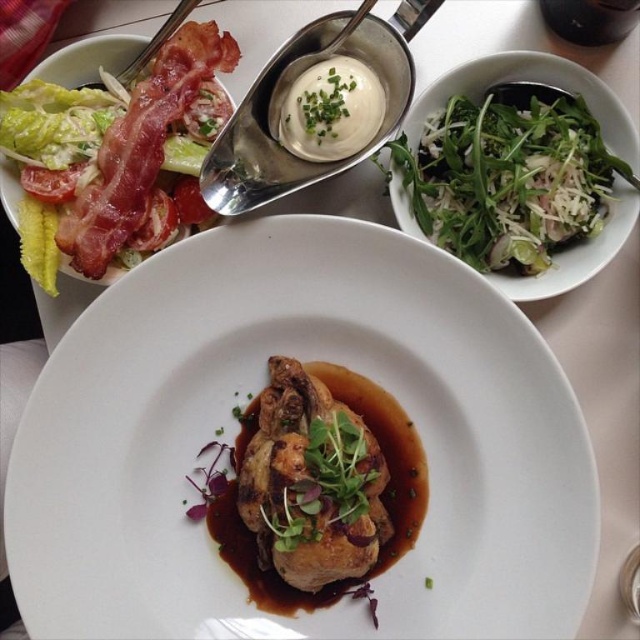
Looking at this image, you are taking a photo of the meal on the table. The camera is focused on the white plate with the chicken. There are two points marked on the table, point 1 at coordinates point [84,148] and point 2 at coordinates point [464,104]. Which point will appear closer to the camera in the photo?

Point [84,148] is closer to the camera than point [464,104], so it will appear closer in the photo.

You are a photographer trying to capture the main dish in the center of the image. You notice two points marked in the scene. Which point, point [618,163] or point [328,131], is closer to your camera lens?

Point [618,163] is closer to the camera than point [328,131].